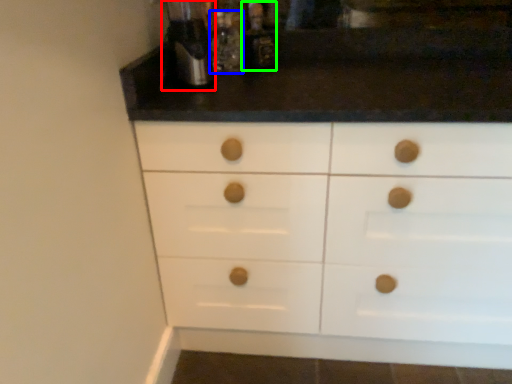
Question: Which object is positioned closest to coffee machine (highlighted by a red box)? Select from bottle (highlighted by a blue box) and bottle (highlighted by a green box).

Choices:
 (A) bottle
 (B) bottle

Answer: (A)